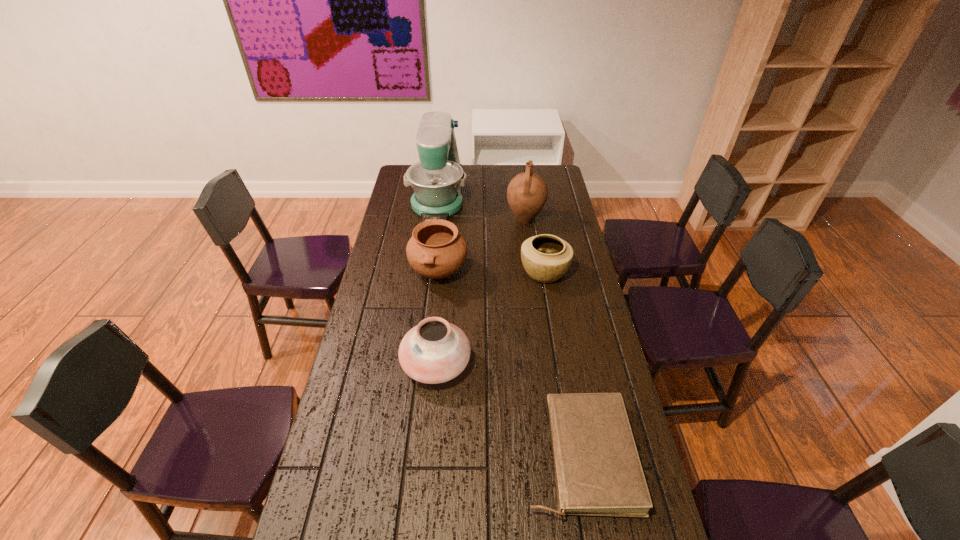
I want to click on free space located 0.260m on the left of the rightmost pottery, so click(454, 272).

The height and width of the screenshot is (540, 960). I want to click on vacant space located on the spine side of the nearest object, so 389,456.

The image size is (960, 540). Find the location of `free space located 0.070m on the spine side of the nearest object`. free space located 0.070m on the spine side of the nearest object is located at coordinates (499, 456).

This screenshot has width=960, height=540. What are the coordinates of `blank space located 0.080m on the spine side of the nearest object` in the screenshot? It's located at (495, 456).

Find the location of `object that is at the far edge`. object that is at the far edge is located at coordinates (437, 179).

Identify the location of mixer located at the left edge. The image size is (960, 540). (437, 179).

Find the location of a particular element. This screenshot has width=960, height=540. pottery at the left edge is located at coordinates (436, 250).

The width and height of the screenshot is (960, 540). In order to click on pitcher that is at the right edge in this screenshot , I will do `click(527, 192)`.

This screenshot has height=540, width=960. Identify the location of pottery that is at the right edge. (546, 258).

Where is `paperback book located in the right edge section of the desktop`? This screenshot has height=540, width=960. paperback book located in the right edge section of the desktop is located at coordinates (598, 472).